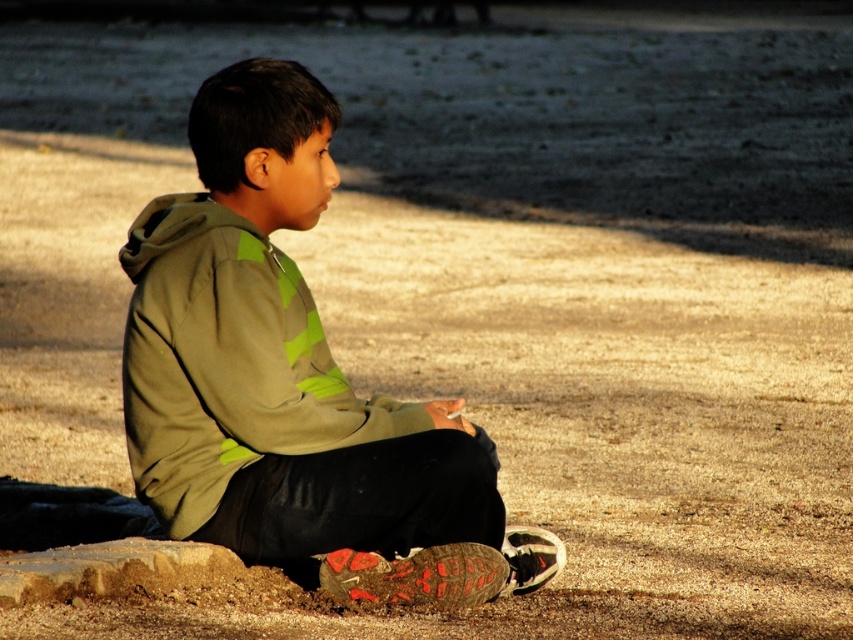
Is green matte hoodie at center shorter than smooth brown rock at lower left?

No, green matte hoodie at center is not shorter than smooth brown rock at lower left.

Can you confirm if green matte hoodie at center is positioned to the left of smooth brown rock at lower left?

Incorrect, green matte hoodie at center is not on the left side of smooth brown rock at lower left.

This screenshot has width=853, height=640. What are the coordinates of `green matte hoodie at center` in the screenshot? It's located at (292, 380).

Measure the distance from olive-green fleece jacket at center to smooth brown rock at lower left.

olive-green fleece jacket at center is 10.90 inches away from smooth brown rock at lower left.

Is olive-green fleece jacket at center taller than smooth brown rock at lower left?

Yes, olive-green fleece jacket at center is taller than smooth brown rock at lower left.

Is point (248, 237) closer to camera compared to point (7, 570)?

No, (248, 237) is behind (7, 570).

You are a GUI agent. You are given a task and a screenshot of the screen. Output one action in this format:
    pyautogui.click(x=<x>, y=<y>)
    Task: Click on the olive-green fleece jacket at center
    This screenshot has width=853, height=640.
    Given the screenshot: What is the action you would take?
    pyautogui.click(x=225, y=362)

Does green matte hoodie at center have a greater width compared to olive-green fleece jacket at center?

Yes, green matte hoodie at center is wider than olive-green fleece jacket at center.

Is point (196, 161) positioned in front of point (166, 454)?

No, it is not.

Who is more distant from viewer, (363, 467) or (154, 493)?

Positioned behind is point (154, 493).

Where is `green matte hoodie at center`? green matte hoodie at center is located at coordinates (292, 380).